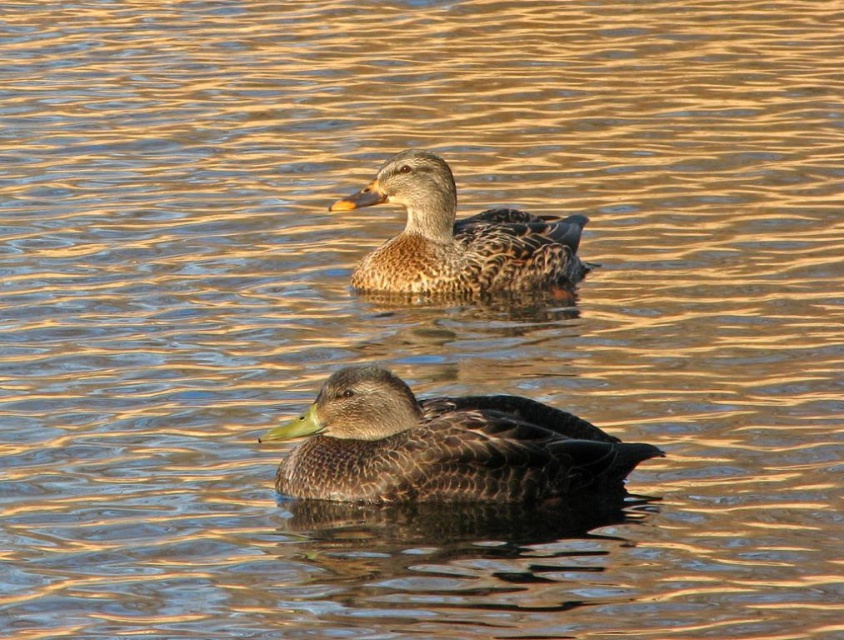
You are a nature photographer observing the ducks in the scene. You want to capture a photo where the dark brown feathers at center and the brown matte duck at upper center are both clearly visible. Considering their sizes, which duck should you focus on to ensure both are in frame without cropping?

The dark brown feathers at center is smaller than the brown matte duck at upper center, so focusing on the larger brown matte duck at upper center would allow the smaller duck to remain in frame without cropping.